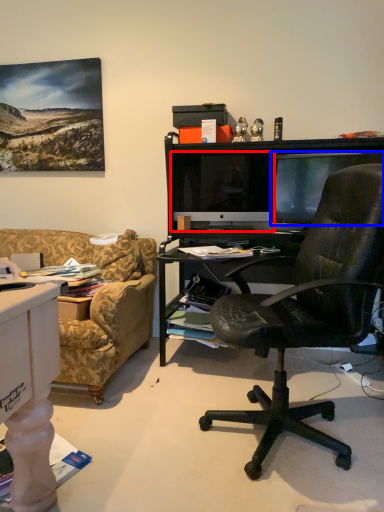
Question: Which of the following is the farthest to the observer, computer monitor (highlighted by a red box) or television (highlighted by a blue box)?

Choices:
 (A) computer monitor
 (B) television

Answer: (A)